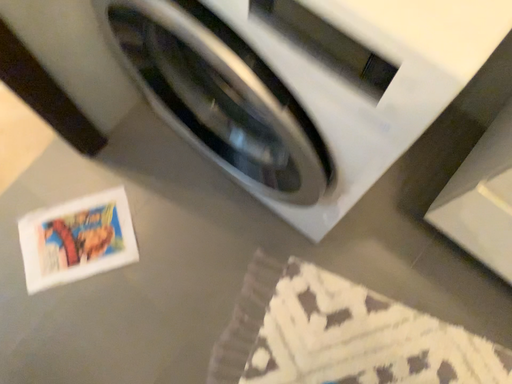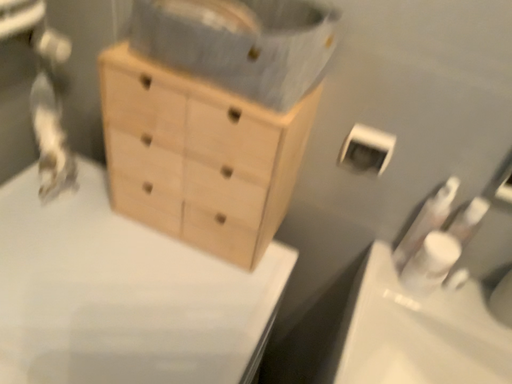
Question: Which way did the camera rotate in the video?

Choices:
 (A) rotated left
 (B) rotated right

Answer: (B)